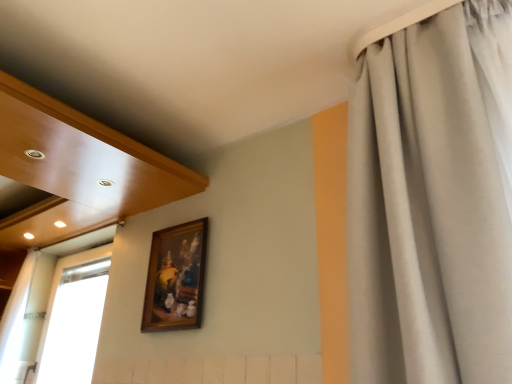
Question: Is wooden frame at upper center spatially inside white sheer curtain at left, or outside of it?

Choices:
 (A) outside
 (B) inside

Answer: (A)

Question: From a real-world perspective, is wooden frame at upper center positioned above or below white sheer curtain at left?

Choices:
 (A) above
 (B) below

Answer: (A)

Question: Which object is positioned farthest from the white sheer curtain at left?

Choices:
 (A) white sheer curtain at left, which is the 1th curtain from left to right
 (B) satin gray curtain at right, the first curtain positioned from the front
 (C) wooden frame at upper center

Answer: (B)

Question: Based on their relative distances, which object is farther from the satin gray curtain at right, the 2th curtain positioned from the back?

Choices:
 (A) white sheer curtain at left, which is the second curtain in front-to-back order
 (B) white sheer curtain at left
 (C) wooden frame at upper center

Answer: (B)